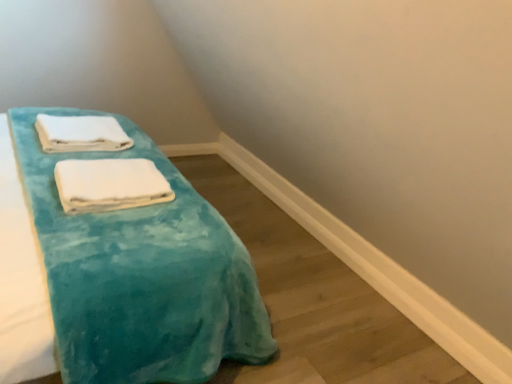
The width and height of the screenshot is (512, 384). What do you see at coordinates (81, 133) in the screenshot?
I see `white soft towel at upper left, which is the 1th towel from back to front` at bounding box center [81, 133].

Image resolution: width=512 pixels, height=384 pixels. What do you see at coordinates (109, 184) in the screenshot? I see `white soft towel at center, which appears as the second towel when viewed from the back` at bounding box center [109, 184].

The image size is (512, 384). I want to click on white soft towel at upper left, placed as the second towel when sorted from bottom to top, so click(81, 133).

Which object is more forward, white soft towel at center, which appears as the second towel when viewed from the back, or white soft towel at upper left, marked as the first towel in a top-to-bottom arrangement?

white soft towel at center, which appears as the second towel when viewed from the back.

Would you say white soft towel at center, marked as the 1th towel in a front-to-back arrangement, is inside or outside white soft towel at upper left, which is the 2th towel from front to back?

white soft towel at center, marked as the 1th towel in a front-to-back arrangement, is spatially situated outside white soft towel at upper left, which is the 2th towel from front to back.

Considering the relative positions of white soft towel at center, arranged as the first towel when ordered from the bottom, and white soft towel at upper left, which is the 2th towel from front to back, in the image provided, is white soft towel at center, arranged as the first towel when ordered from the bottom, to the right of white soft towel at upper left, which is the 2th towel from front to back, from the viewer's perspective?

Indeed, white soft towel at center, arranged as the first towel when ordered from the bottom, is positioned on the right side of white soft towel at upper left, which is the 2th towel from front to back.

Which object is wider, white soft towel at center, arranged as the first towel when ordered from the bottom, or white soft towel at upper left, which is the 1th towel from back to front?

white soft towel at upper left, which is the 1th towel from back to front, is wider.

Looking at this image, from the image's perspective, is turquoise soft towel at center over white soft towel at upper left, which is the 2th towel from front to back?

Incorrect, from the image's perspective, turquoise soft towel at center is lower than white soft towel at upper left, which is the 2th towel from front to back.

Which point is more forward, (142, 141) or (99, 150)?

The point (99, 150) is more forward.

Can we say turquoise soft towel at center lies outside white soft towel at upper left, which is the 1th towel from back to front?

Yes, turquoise soft towel at center is located beyond the bounds of white soft towel at upper left, which is the 1th towel from back to front.

Is white soft towel at upper left, marked as the first towel in a top-to-bottom arrangement, in contact with white soft towel at center, arranged as the first towel when ordered from the bottom?

white soft towel at upper left, marked as the first towel in a top-to-bottom arrangement, and white soft towel at center, arranged as the first towel when ordered from the bottom, are not in contact.

Between point (37, 124) and point (112, 196), which one is positioned behind?

The point (37, 124) is farther.

Which is behind, white soft towel at upper left, placed as the second towel when sorted from bottom to top, or white soft towel at center, arranged as the first towel when ordered from the bottom?

white soft towel at upper left, placed as the second towel when sorted from bottom to top, is further from the camera.

Is white soft towel at upper left, placed as the second towel when sorted from bottom to top, shorter than white soft towel at center, arranged as the first towel when ordered from the bottom?

No, white soft towel at upper left, placed as the second towel when sorted from bottom to top, is not shorter than white soft towel at center, arranged as the first towel when ordered from the bottom.

From a real-world perspective, is white soft towel at upper left, placed as the second towel when sorted from bottom to top, beneath turquoise soft towel at center?

Indeed, from a real-world perspective, white soft towel at upper left, placed as the second towel when sorted from bottom to top, is positioned beneath turquoise soft towel at center.

Which of these two, white soft towel at upper left, placed as the second towel when sorted from bottom to top, or turquoise soft towel at center, is wider?

Wider between the two is turquoise soft towel at center.

Based on their sizes in the image, would you say white soft towel at upper left, which is the 1th towel from back to front, is bigger or smaller than turquoise soft towel at center?

Clearly, white soft towel at upper left, which is the 1th towel from back to front, is smaller in size than turquoise soft towel at center.

Is point (58, 126) positioned after point (232, 257)?

Yes, it is.

From the image's perspective, relative to turquoise soft towel at center, is white soft towel at center, marked as the 1th towel in a front-to-back arrangement, above or below?

Based on their image positions, white soft towel at center, marked as the 1th towel in a front-to-back arrangement, is located beneath turquoise soft towel at center.

Is the position of white soft towel at center, marked as the 1th towel in a front-to-back arrangement, more distant than that of turquoise soft towel at center?

That is True.

Do you think white soft towel at center, which appears as the second towel when viewed from the back, is within turquoise soft towel at center, or outside of it?

white soft towel at center, which appears as the second towel when viewed from the back, exists entirely within turquoise soft towel at center.

Does turquoise soft towel at center contain white soft towel at center, which appears as the second towel when viewed from the back?

Yes, white soft towel at center, which appears as the second towel when viewed from the back, is a part of turquoise soft towel at center.

From the image's perspective, is turquoise soft towel at center beneath white soft towel at center, marked as the 1th towel in a front-to-back arrangement?

No, from the image's perspective, turquoise soft towel at center is not below white soft towel at center, marked as the 1th towel in a front-to-back arrangement.

Considering the sizes of objects turquoise soft towel at center and white soft towel at center, which is the second towel in top-to-bottom order, in the image provided, who is taller, turquoise soft towel at center or white soft towel at center, which is the second towel in top-to-bottom order,?

Standing taller between the two is turquoise soft towel at center.

Which of these two, turquoise soft towel at center or white soft towel at center, which appears as the second towel when viewed from the back, is bigger?

With larger size is turquoise soft towel at center.

Identify the location of towel behind the white soft towel at center, marked as the 1th towel in a front-to-back arrangement. The height and width of the screenshot is (384, 512). (81, 133).

This screenshot has width=512, height=384. In the image, there is a white soft towel at upper left, marked as the first towel in a top-to-bottom arrangement. In order to click on furniture below it (from the image's perspective) in this screenshot , I will do `click(140, 273)`.

Looking at the image, which one is located closer to white soft towel at center, which is the second towel in top-to-bottom order, white soft towel at upper left, which is the 1th towel from back to front, or turquoise soft towel at center?

turquoise soft towel at center is closer to white soft towel at center, which is the second towel in top-to-bottom order.

Estimate the real-world distances between objects in this image. Which object is closer to turquoise soft towel at center, white soft towel at upper left, which is the 2th towel from front to back, or white soft towel at center, which appears as the second towel when viewed from the back?

Based on the image, white soft towel at center, which appears as the second towel when viewed from the back, appears to be nearer to turquoise soft towel at center.

From the image, which object appears to be nearer to turquoise soft towel at center, white soft towel at center, marked as the 1th towel in a front-to-back arrangement, or white soft towel at upper left, marked as the first towel in a top-to-bottom arrangement?

The object closer to turquoise soft towel at center is white soft towel at center, marked as the 1th towel in a front-to-back arrangement.

Looking at the image, which one is located closer to white soft towel at center, arranged as the first towel when ordered from the bottom, turquoise soft towel at center or white soft towel at upper left, marked as the first towel in a top-to-bottom arrangement?

Among the two, turquoise soft towel at center is located nearer to white soft towel at center, arranged as the first towel when ordered from the bottom.

Consider the image. From the image, which object appears to be farther from white soft towel at upper left, placed as the second towel when sorted from bottom to top, white soft towel at center, which appears as the second towel when viewed from the back, or turquoise soft towel at center?

turquoise soft towel at center.

Which object lies further to the anchor point white soft towel at upper left, which is the 2th towel from front to back, turquoise soft towel at center or white soft towel at center, marked as the 1th towel in a front-to-back arrangement?

Among the two, turquoise soft towel at center is located further to white soft towel at upper left, which is the 2th towel from front to back.

Identify the location of towel located between turquoise soft towel at center and white soft towel at upper left, marked as the first towel in a top-to-bottom arrangement, in the depth direction. (109, 184).